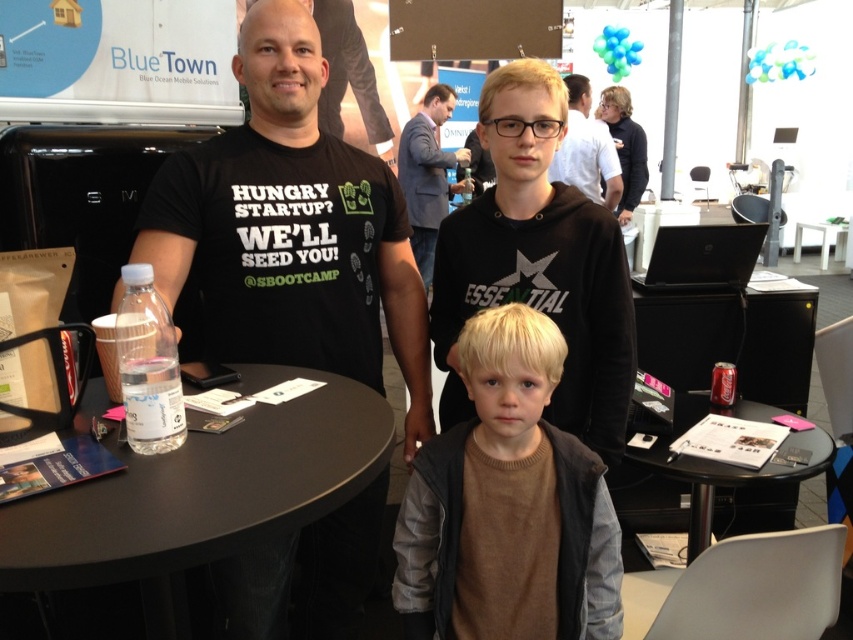
Is black matte t-shirt at center bigger than matte black shirt at upper center?

No, black matte t-shirt at center is not bigger than matte black shirt at upper center.

Is point (276, 28) closer to camera compared to point (596, 173)?

Yes, it is in front of point (596, 173).

The width and height of the screenshot is (853, 640). In order to click on black matte t-shirt at center in this screenshot , I will do [291, 228].

Which of these two, dark gray suit at center or matte black shirt at upper center, stands taller?

Standing taller between the two is dark gray suit at center.

Is point (428, 209) less distant than point (572, 106)?

No.

Where is `dark gray suit at center`? dark gray suit at center is located at coordinates (428, 173).

Can you confirm if transparent plastic table at center is positioned to the right of matte black shirt at upper center?

Incorrect, transparent plastic table at center is not on the right side of matte black shirt at upper center.

Can you confirm if transparent plastic table at center is thinner than matte black shirt at upper center?

Yes.

Who is more distant from viewer, (96, 412) or (579, 189)?

Point (579, 189)

At what (x,y) coordinates should I click in order to perform the action: click on transparent plastic table at center. Please return your answer as a coordinate pair (x, y). Looking at the image, I should click on (201, 497).